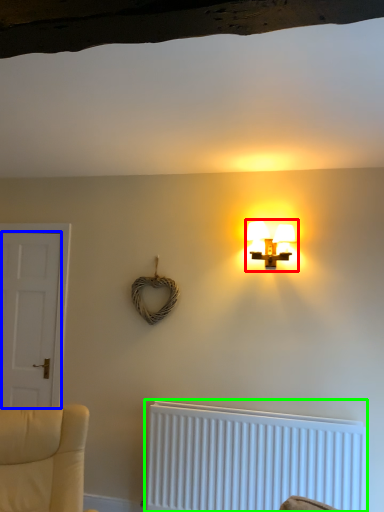
Question: Which is nearer to the lamp (highlighted by a red box)? door (highlighted by a blue box) or radiator (highlighted by a green box).

Choices:
 (A) door
 (B) radiator

Answer: (B)